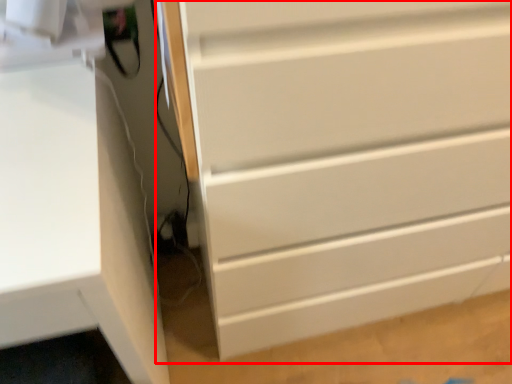
Question: From the image's perspective, considering the relative positions of chest of drawers (annotated by the red box) and computer desk in the image provided, where is chest of drawers (annotated by the red box) located with respect to the staircase?

Choices:
 (A) below
 (B) above

Answer: (B)